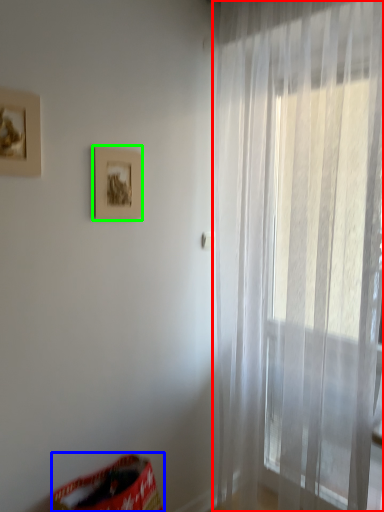
Question: Based on their relative distances, which object is nearer to curtain (highlighted by a red box)? Choose from bean bag chair (highlighted by a blue box) and picture frame (highlighted by a green box).

Choices:
 (A) bean bag chair
 (B) picture frame

Answer: (B)